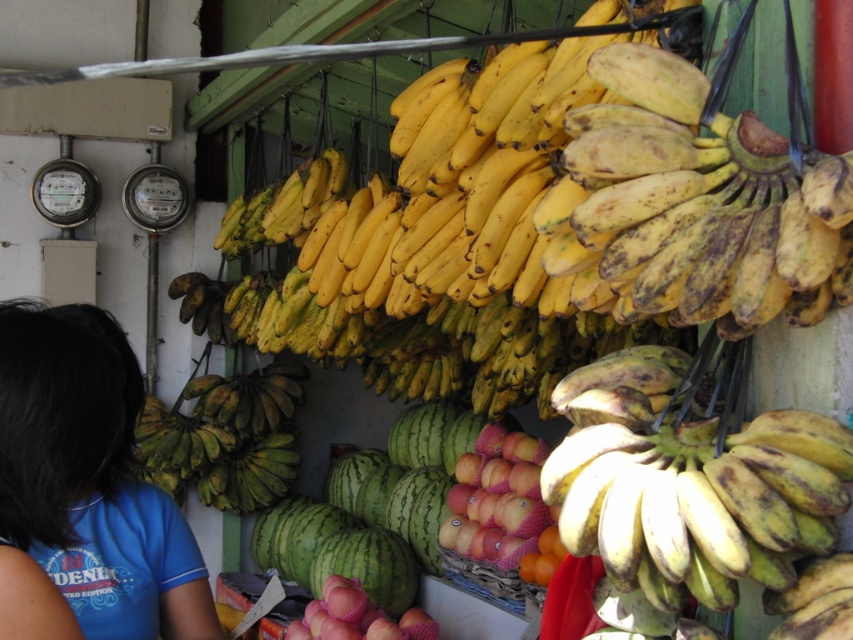
You are standing at the fruit stall and want to reach a point that is exactly 4.35 feet away from you. Is the point at coordinates point [113,362] within this distance?

The distance of point [113,362] from viewer is 4.35 feet, so yes, the point at coordinates point [113,362] is exactly 4.35 feet away from you.

You are a customer at the fruit stall and want to grab the yellow matte bananas at center. However, you notice the blue fabric shirt at lower left. Can you reach the bananas without moving the shirt?

The blue fabric shirt at lower left is much taller than the yellow matte bananas at center, so the shirt is blocking your view of the bananas. You might need to move the shirt to reach them.

You are a customer at the fruit stall and want to pick up the ripe yellow bananas at center. However, there is a blue fabric shirt at lower left in your way. Can you reach the bananas without moving the shirt?

The ripe yellow bananas at center is shorter than blue fabric shirt at lower left, so the shirt is taller and blocking the bananas. You need to move the shirt to reach them.